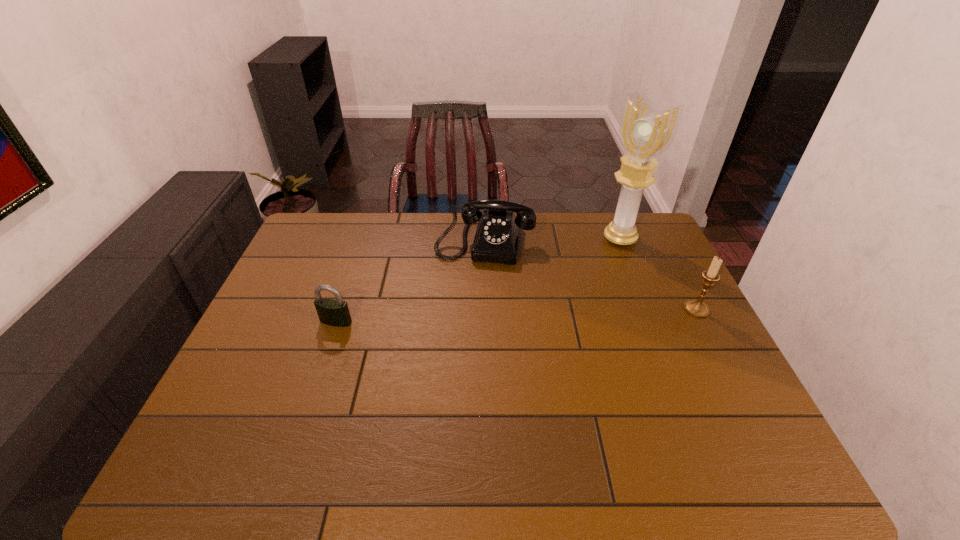
At what (x,y) coordinates should I click in order to perform the action: click on the leftmost object. Please return your answer as a coordinate pair (x, y). The width and height of the screenshot is (960, 540). Looking at the image, I should click on (331, 312).

The width and height of the screenshot is (960, 540). I want to click on padlock, so click(331, 312).

At what (x,y) coordinates should I click in order to perform the action: click on the rightmost object. Please return your answer as a coordinate pair (x, y). Image resolution: width=960 pixels, height=540 pixels. Looking at the image, I should click on (697, 308).

The width and height of the screenshot is (960, 540). I want to click on award, so click(x=644, y=134).

Where is `the tallest object`? the tallest object is located at coordinates (644, 134).

The height and width of the screenshot is (540, 960). Find the location of `the second shortest object`. the second shortest object is located at coordinates (496, 240).

The height and width of the screenshot is (540, 960). What are the coordinates of `telephone` in the screenshot? It's located at (496, 240).

Locate an element on the screen. The height and width of the screenshot is (540, 960). free location located 0.270m on the right of the shortest object is located at coordinates (447, 322).

At what (x,y) coordinates should I click in order to perform the action: click on free space located 0.330m on the back of the rightmost object. Please return your answer as a coordinate pair (x, y). The image size is (960, 540). Looking at the image, I should click on (659, 236).

Locate an element on the screen. The height and width of the screenshot is (540, 960). vacant space located 0.400m on the front-facing side of the award is located at coordinates (528, 302).